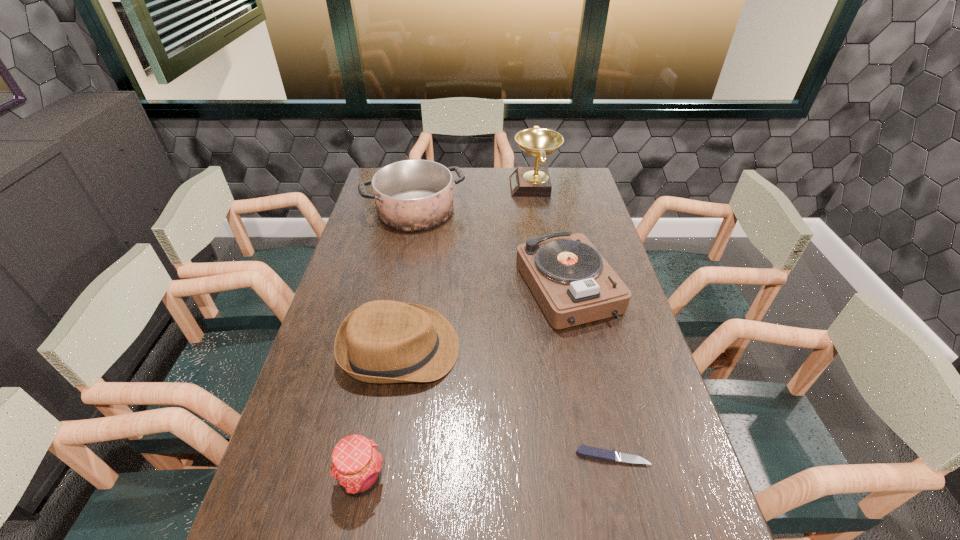
Image resolution: width=960 pixels, height=540 pixels. Find the location of `record player that is at the right edge`. record player that is at the right edge is located at coordinates (573, 284).

At what (x,y) coordinates should I click in order to perform the action: click on steak knife at the right edge. Please return your answer as a coordinate pair (x, y). Looking at the image, I should click on (595, 453).

At what (x,y) coordinates should I click in order to perform the action: click on object present at the far left corner. Please return your answer as a coordinate pair (x, y). The width and height of the screenshot is (960, 540). Looking at the image, I should click on (412, 195).

Image resolution: width=960 pixels, height=540 pixels. I want to click on object present at the far right corner, so click(x=535, y=181).

Find the location of a particular element. This screenshot has width=960, height=540. free space at the far edge is located at coordinates (462, 187).

Where is `free space at the left edge`? Image resolution: width=960 pixels, height=540 pixels. free space at the left edge is located at coordinates (343, 404).

Where is `free space at the right edge of the desktop`? The height and width of the screenshot is (540, 960). free space at the right edge of the desktop is located at coordinates (621, 380).

In order to click on vacant point located between the record player and the jam in this screenshot , I will do `click(465, 382)`.

You are a GUI agent. You are given a task and a screenshot of the screen. Output one action in this format:
    pyautogui.click(x=<x>, y=<y>)
    Task: Click on the free point between the record player and the saucepan
    The image size is (960, 540).
    Given the screenshot: What is the action you would take?
    pyautogui.click(x=492, y=249)

At what (x,y) coordinates should I click in order to perform the action: click on free space between the second tallest object and the steak knife. Please return your answer as a coordinate pair (x, y). The image size is (960, 540). Looking at the image, I should click on (514, 334).